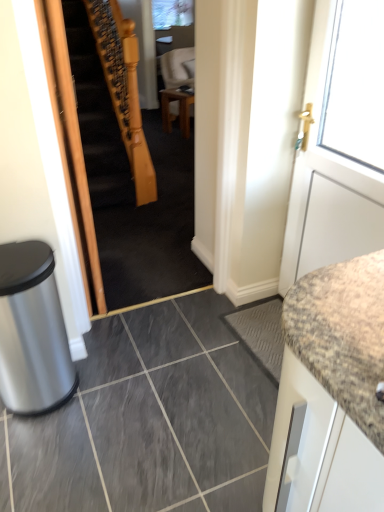
Question: Is wooden table at center outside wooden staircase at center?

Choices:
 (A) no
 (B) yes

Answer: (B)

Question: Is wooden table at center taller than wooden staircase at center?

Choices:
 (A) no
 (B) yes

Answer: (A)

Question: Is wooden table at center looking in the opposite direction of wooden staircase at center?

Choices:
 (A) no
 (B) yes

Answer: (A)

Question: Does wooden table at center turn towards wooden staircase at center?

Choices:
 (A) no
 (B) yes

Answer: (A)

Question: Is wooden table at center far away from wooden staircase at center?

Choices:
 (A) no
 (B) yes

Answer: (B)

Question: Can you confirm if wooden table at center is smaller than wooden staircase at center?

Choices:
 (A) no
 (B) yes

Answer: (B)

Question: Can you confirm if silver metallic trash bin at lower left is positioned to the right of wooden staircase at center?

Choices:
 (A) yes
 (B) no

Answer: (B)

Question: Does silver metallic trash bin at lower left have a greater height compared to wooden staircase at center?

Choices:
 (A) yes
 (B) no

Answer: (B)

Question: Does silver metallic trash bin at lower left have a larger size compared to wooden staircase at center?

Choices:
 (A) no
 (B) yes

Answer: (A)

Question: Is silver metallic trash bin at lower left smaller than wooden staircase at center?

Choices:
 (A) no
 (B) yes

Answer: (B)

Question: Are silver metallic trash bin at lower left and wooden staircase at center located far from each other?

Choices:
 (A) no
 (B) yes

Answer: (B)

Question: Can you confirm if silver metallic trash bin at lower left is shorter than wooden staircase at center?

Choices:
 (A) no
 (B) yes

Answer: (B)

Question: Is wooden table at center at the back of silver metallic trash bin at lower left?

Choices:
 (A) yes
 (B) no

Answer: (B)